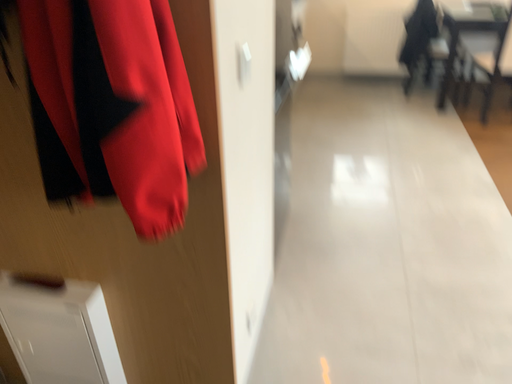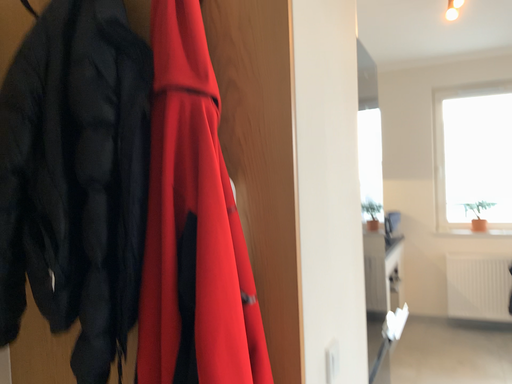
Question: How did the camera likely rotate when shooting the video?

Choices:
 (A) rotated left
 (B) rotated right

Answer: (A)